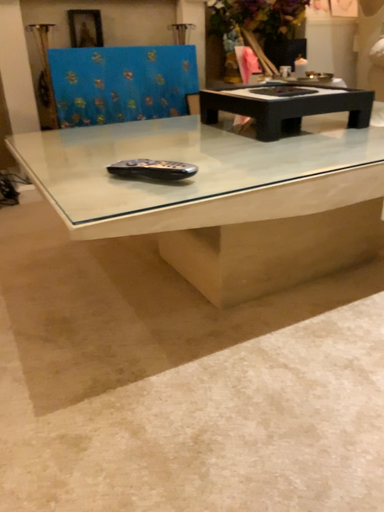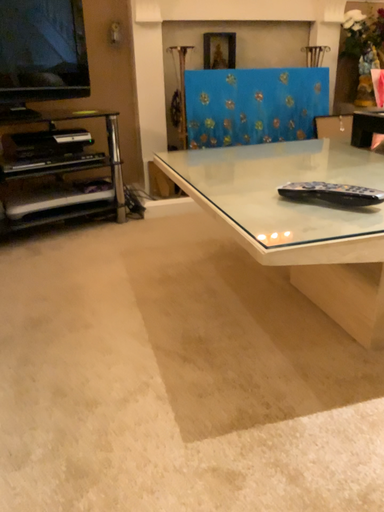
Question: Which way did the camera rotate in the video?

Choices:
 (A) rotated left
 (B) rotated right

Answer: (A)